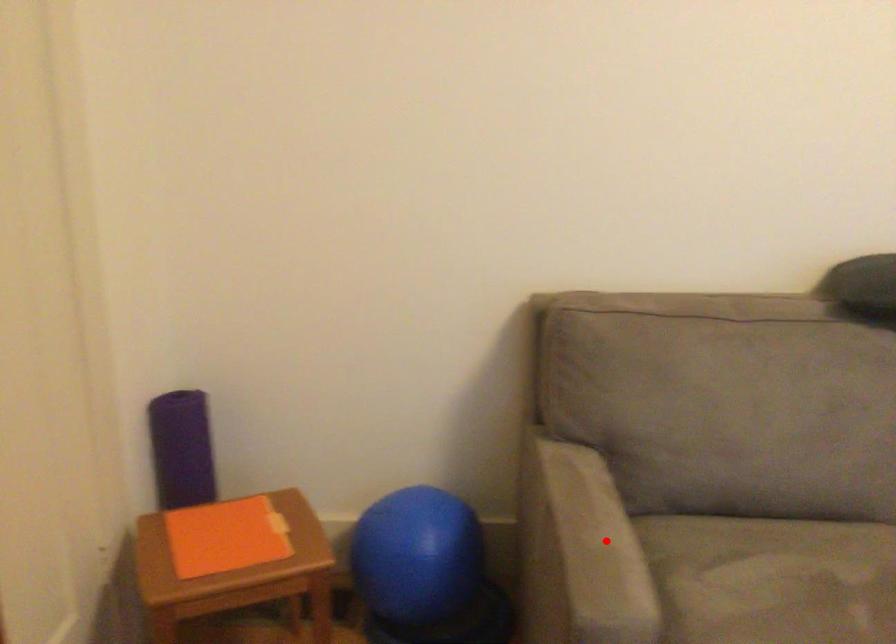
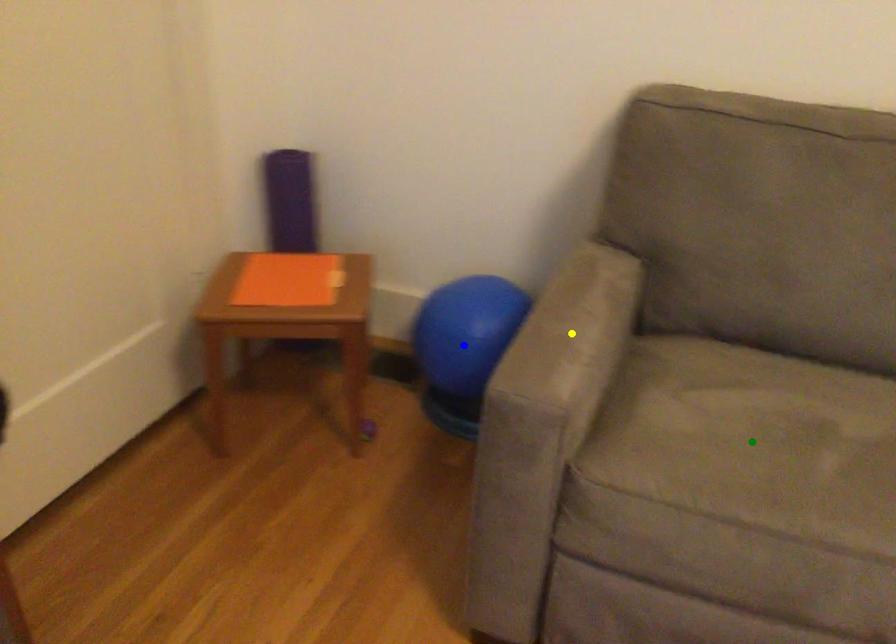
Question: I am providing you with two images of the same scene from different viewpoints. A red point is marked on the first image. You are given multiple points on the second image. Which mark in image 2 goes with the point in image 1?

Choices:
 (A) yellow point
 (B) blue point
 (C) green point

Answer: (A)